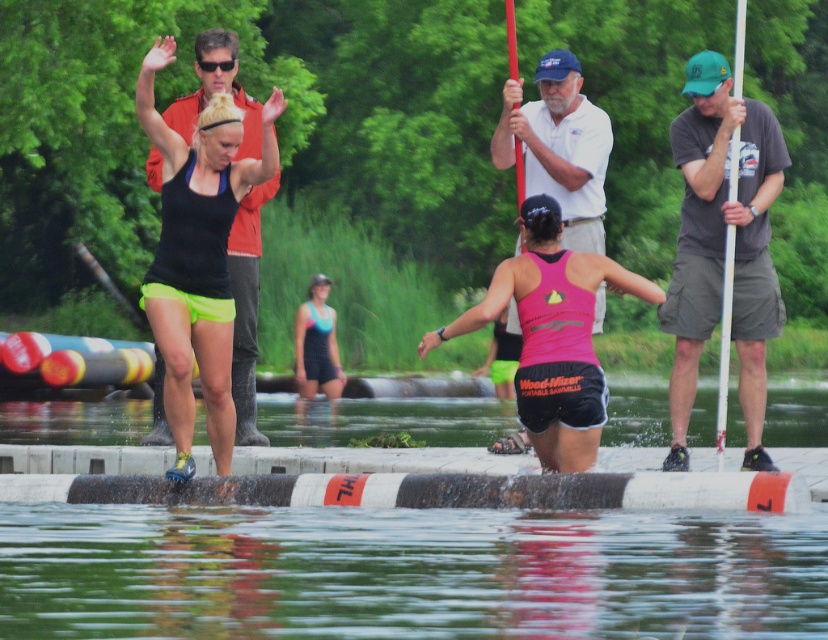
Question: Is gray cotton t-shirt at right wider than blue fabric swimsuit at center?

Choices:
 (A) yes
 (B) no

Answer: (A)

Question: Which object is closer to the camera taking this photo?

Choices:
 (A) white smooth water at lower center
 (B) transparent water at lower center
 (C) pink matte tank top at center
 (D) blue fabric swimsuit at center

Answer: (B)

Question: Which point is closer to the camera?

Choices:
 (A) (314, 353)
 (B) (359, 403)

Answer: (B)

Question: Which of the following is the closest to the observer?

Choices:
 (A) (562, 445)
 (B) (734, 92)
 (C) (612, 433)
 (D) (326, 288)

Answer: (A)

Question: Is white cotton shirt at center behind white plastic pole at right?

Choices:
 (A) no
 (B) yes

Answer: (B)

Question: Can you confirm if white smooth water at lower center is positioned to the right of blue fabric swimsuit at center?

Choices:
 (A) no
 (B) yes

Answer: (B)